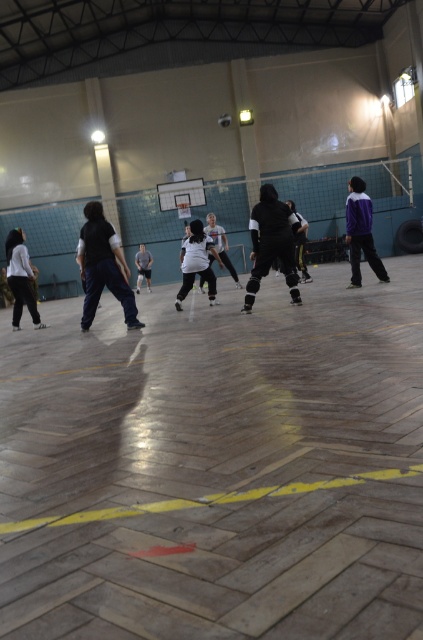
Question: Which of the following is the closest to the observer?

Choices:
 (A) dark blue pants at center
 (B) matte white shirt at left

Answer: (A)

Question: Among these points, which one is farthest from the camera?

Choices:
 (A) (145, 250)
 (B) (219, 262)
 (C) (261, 240)
 (D) (101, 275)

Answer: (A)

Question: Is black matte/soft clothing at center wider than matte white shirt at left?

Choices:
 (A) no
 (B) yes

Answer: (B)

Question: Which object appears closest to the camera in this image?

Choices:
 (A) purple matte jacket at right
 (B) black matte pants at center
 (C) black matte jacket at center

Answer: (A)

Question: Is black matte/soft clothing at center to the right of white matte shirt at center from the viewer's perspective?

Choices:
 (A) yes
 (B) no

Answer: (A)

Question: Can you confirm if purple matte jacket at right is thinner than matte white shirt at left?

Choices:
 (A) no
 (B) yes

Answer: (A)